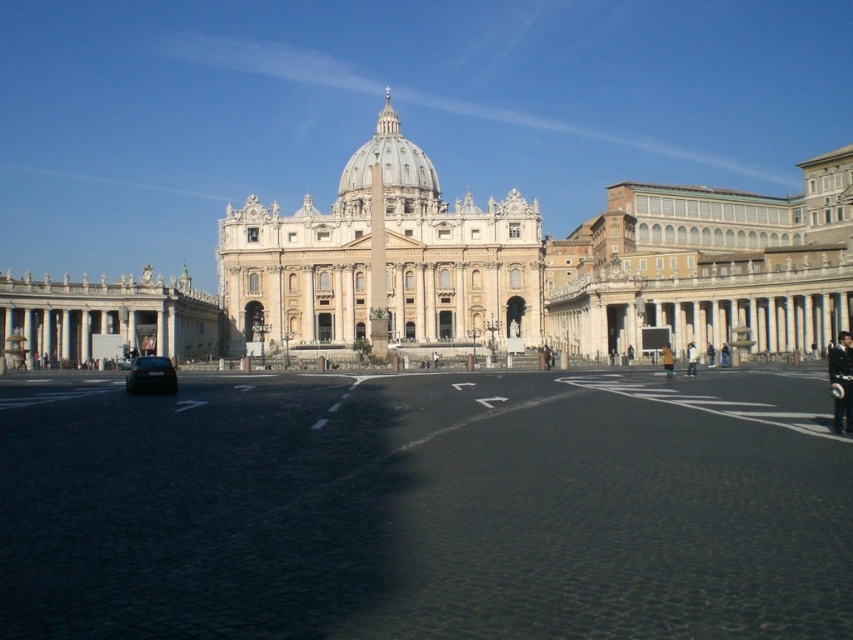
You are standing in the square in front of St. Peter Basilica. You see a shiny black car at lower left. Where is the point at coordinate (x=151, y=376) located?

The point at coordinate (x=151, y=376) is located on the shiny black car at lower left.

From the picture: You are a tourist standing in the square in front of St. Peter Basilica. You see two people wearing a dark uniform at right and a light brown leather jacket at right. Which one is higher up?

The dark uniform at right is above the light brown leather jacket at right, so the person wearing the dark uniform at right is higher up.